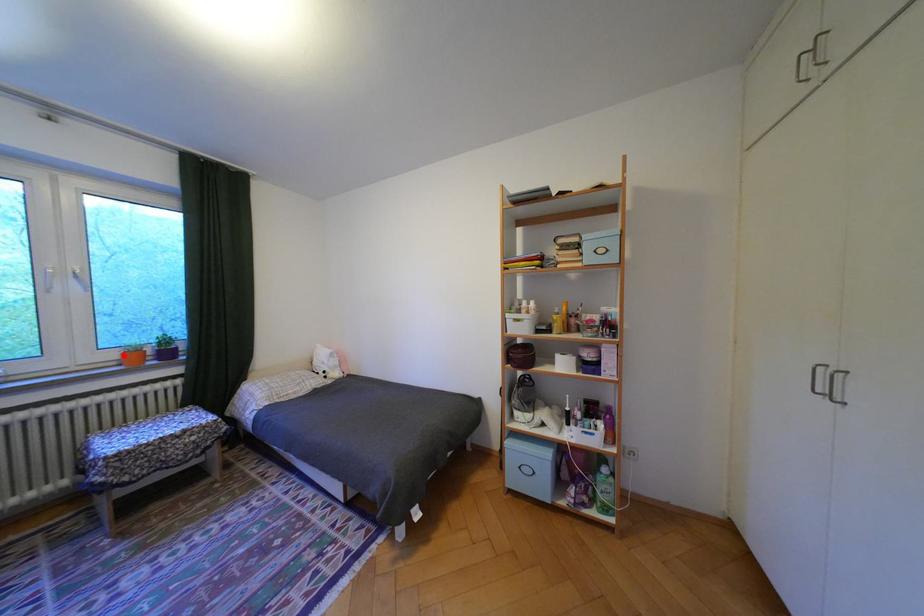
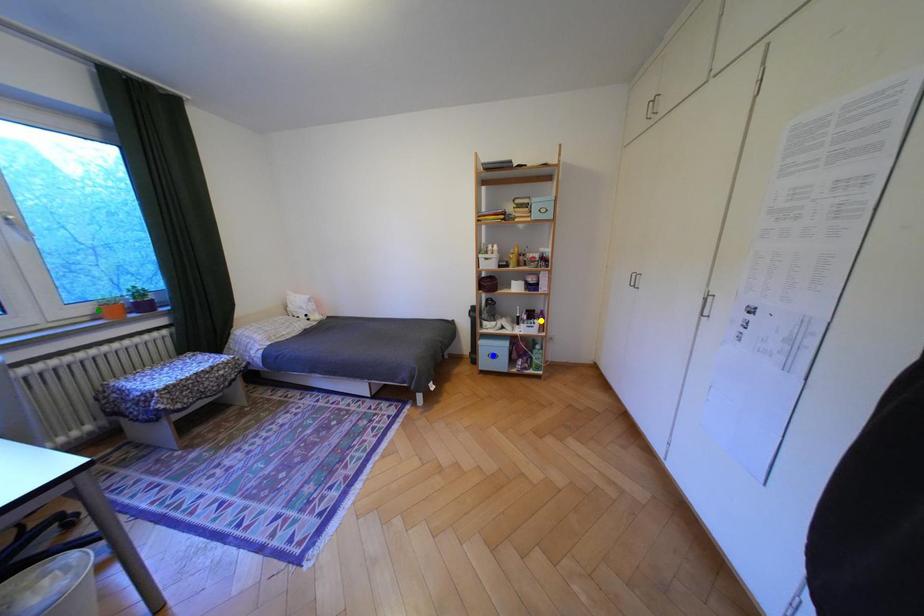
Question: I am providing you with two images of the same scene from different viewpoints. A red point is marked on the first image. You are given multiple points on the second image. Which point in image 2 represents the same 3d spot as the red point in image 1?

Choices:
 (A) blue point
 (B) yellow point
 (C) green point

Answer: (C)